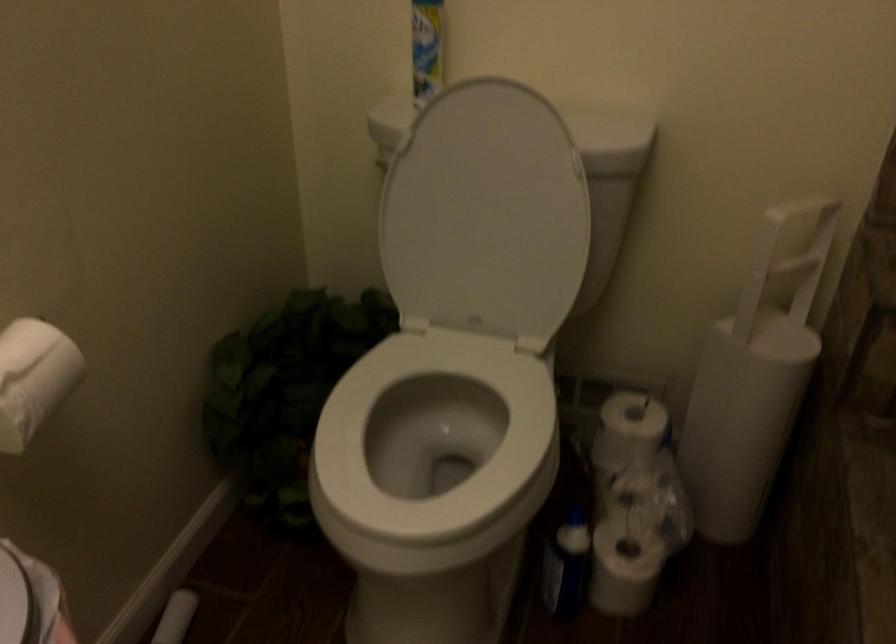
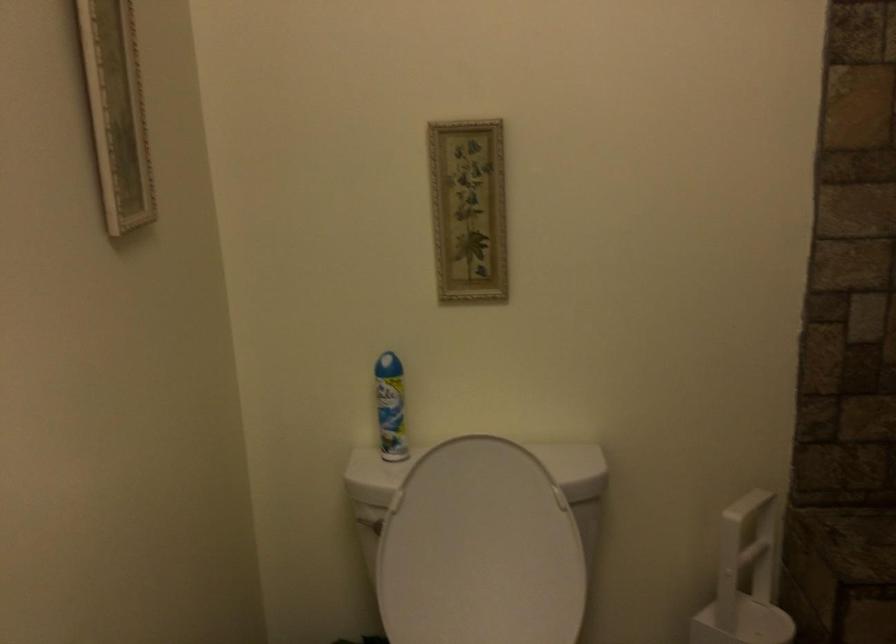
Question: The images are taken continuously from a first-person perspective. In which direction are you moving?

Choices:
 (A) Left
 (B) Right
 (C) Forward
 (D) Backward

Answer: (A)